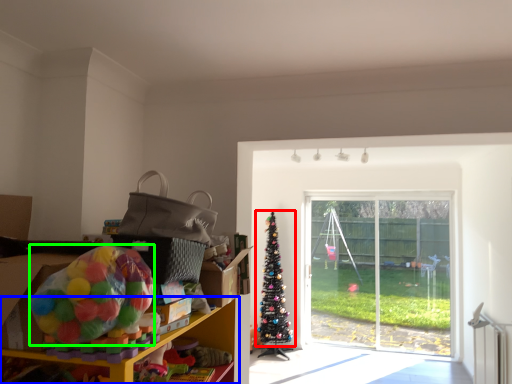
Question: Based on their relative distances, which object is nearer to christmas tree (highlighted by a red box)? Choose from shelf (highlighted by a blue box) and toy (highlighted by a green box).

Choices:
 (A) shelf
 (B) toy

Answer: (A)